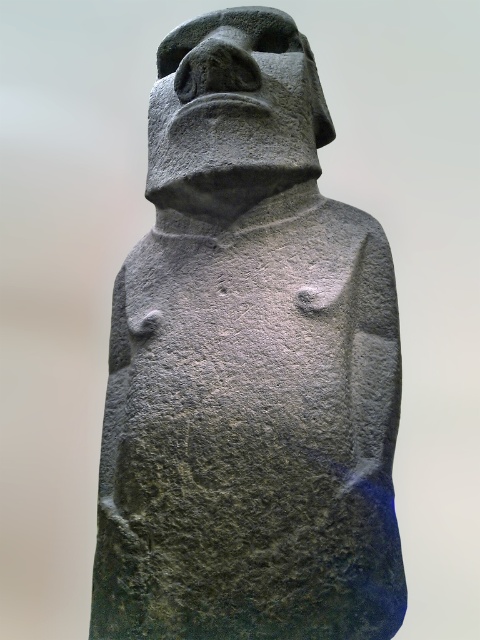
You are an archaeologist examining the gray stone statue at center and the gray stone head at upper center in the image. Based on their sizes, which object would require more effort to move? Please explain your reasoning.

The gray stone statue at center is larger in size than the gray stone head at upper center. Therefore, the gray stone statue at center would require more effort to move due to its greater mass and size.